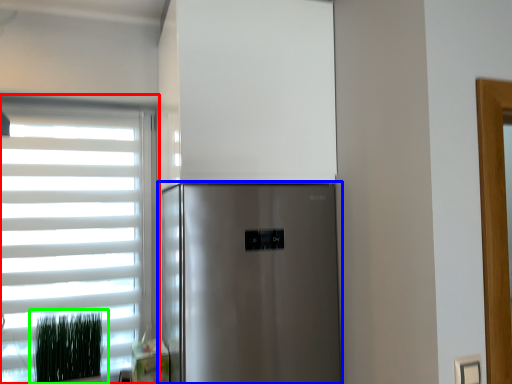
Question: Which object is the closest to the window (highlighted by a red box)? Choose among these: refrigerator (highlighted by a blue box) or plant (highlighted by a green box).

Choices:
 (A) refrigerator
 (B) plant

Answer: (B)